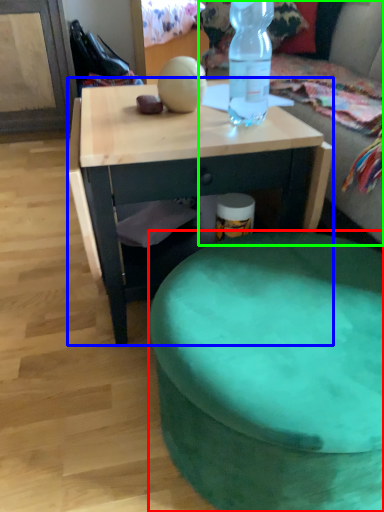
Question: Which is nearer to the stool (highlighted by a red box)? desk (highlighted by a blue box) or bean bag chair (highlighted by a green box).

Choices:
 (A) desk
 (B) bean bag chair

Answer: (A)